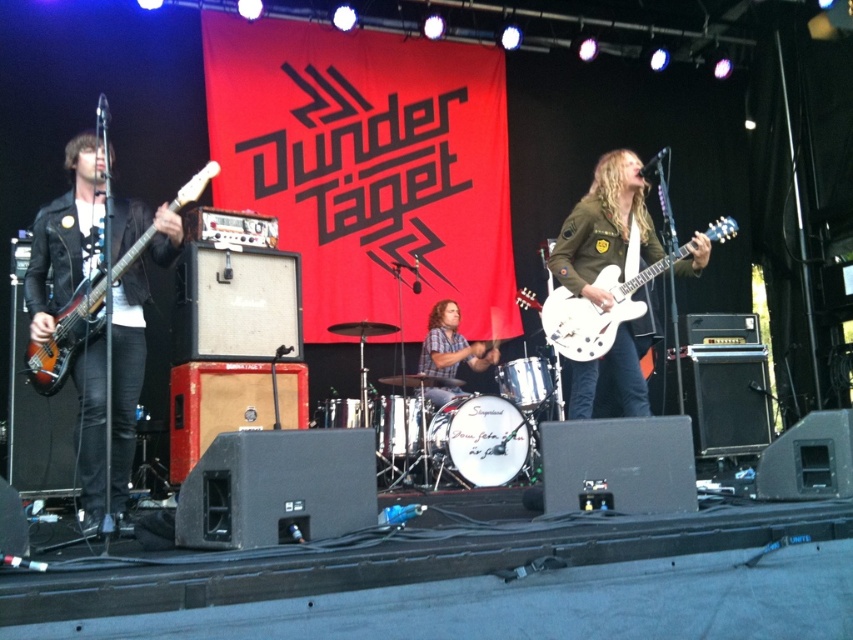
You are a stagehand who needs to place a protective cover over the white glossy electric guitar at center and the matte brown electric guitar at left. Which guitar requires a larger cover?

The matte brown electric guitar at left requires a larger cover because it is bigger than the white glossy electric guitar at center.